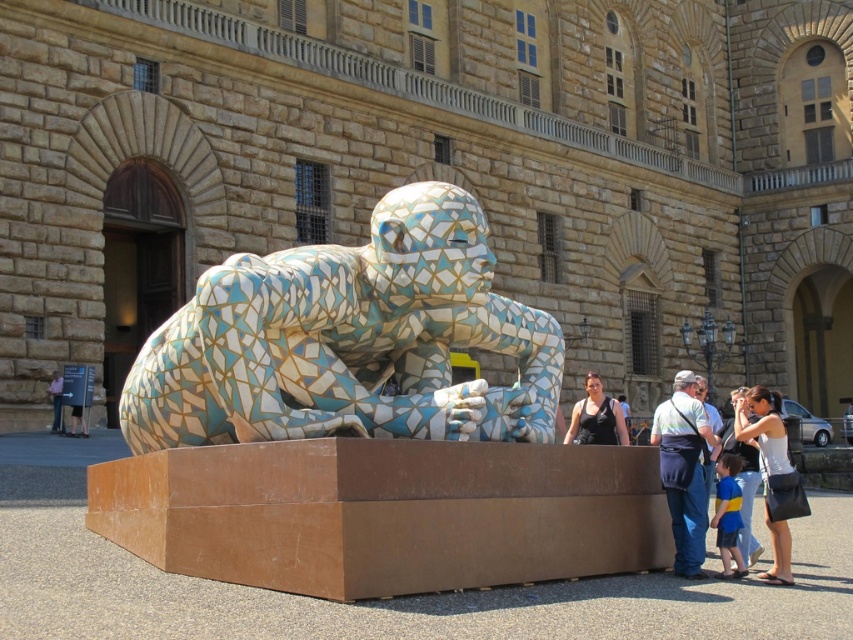
Question: Estimate the real-world distances between objects in this image. Which object is closer to the matte black shirt at lower left?

Choices:
 (A) white fabric purse at lower right
 (B) striped shirt at lower right
 (C) denim jeans at lower right
 (D) mosaic tile sculpture at center

Answer: (D)

Question: Which point is farther to the camera?

Choices:
 (A) matte black tank top at center
 (B) white fabric purse at lower right
 (C) mosaic tile sculpture at center

Answer: (A)

Question: Does mosaic tile sculpture at center appear over striped shirt at lower right?

Choices:
 (A) yes
 (B) no

Answer: (A)

Question: Which object is closer to the camera taking this photo?

Choices:
 (A) mosaic tile sculpture at center
 (B) denim jeans at lower right

Answer: (A)

Question: Can you confirm if denim jeans at lower right is smaller than matte black tank top at center?

Choices:
 (A) no
 (B) yes

Answer: (B)

Question: Does striped shirt at lower right have a smaller size compared to matte black shirt at lower left?

Choices:
 (A) yes
 (B) no

Answer: (B)